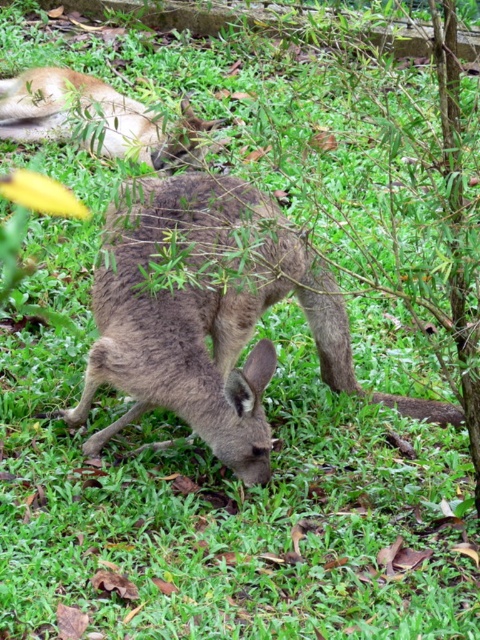
Between brown fur kangaroo at center and brown fur kangaroo at upper left, which one has less height?

brown fur kangaroo at upper left

Which is behind, point (193, 376) or point (123, 150)?

The point (123, 150) is more distant.

This screenshot has height=640, width=480. Find the location of `brown fur kangaroo at center`. brown fur kangaroo at center is located at coordinates (204, 323).